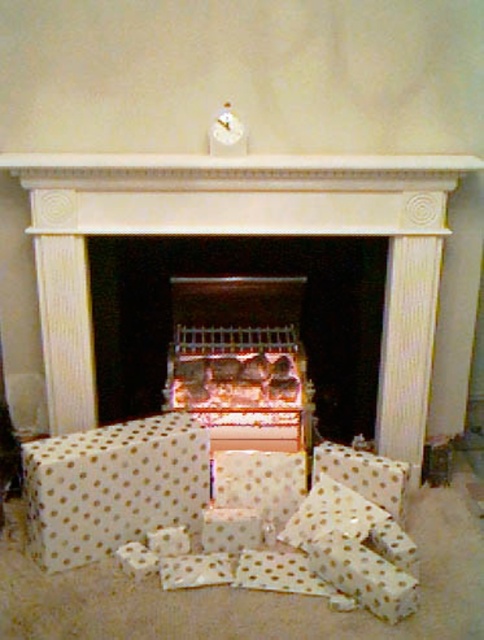
Question: Can you confirm if white marble fireplace at center is wider than white polka dot wrapping paper at lower center?

Choices:
 (A) yes
 (B) no

Answer: (A)

Question: Observing the image, what is the correct spatial positioning of white marble fireplace at center in reference to white polka dot wrapping paper at lower center?

Choices:
 (A) above
 (B) below

Answer: (A)

Question: Is white marble fireplace at center closer to camera compared to wooden fireplace at center?

Choices:
 (A) no
 (B) yes

Answer: (B)

Question: Among these points, which one is farthest from the camera?

Choices:
 (A) (290, 157)
 (B) (326, 426)
 (C) (122, 154)

Answer: (B)

Question: Which point appears closest to the camera in this image?

Choices:
 (A) (282, 259)
 (B) (362, 157)
 (C) (102, 445)
 (D) (422, 378)

Answer: (C)

Question: Which object is farther from the camera taking this photo?

Choices:
 (A) wooden fireplace at center
 (B) white marble fireplace at center

Answer: (A)